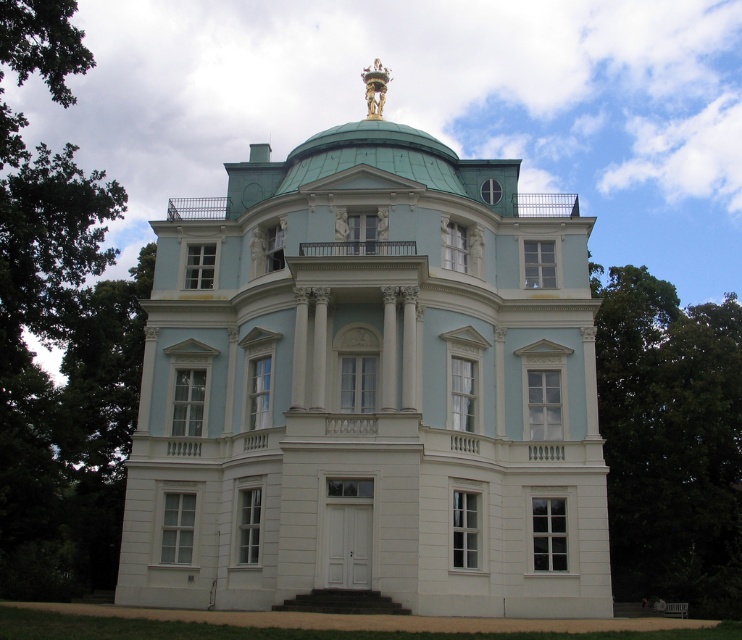
You are an architect planning to add a new sculpture on the roof of the light blue stone mansion at center. The sculpture requires a flat area that is not covered by the green metallic dome at center. Based on the image, is there enough space available on the mansion roof for the sculpture?

The light blue stone mansion at center is positioned under the green metallic dome at center, which means the dome covers part of the mansion roof. Therefore, there might be limited space available for the sculpture on the mansion roof where it is not covered by the dome.

You are standing at the entrance of the light blue stone mansion at center. If you walk straight ahead, will you eventually face the golden statue on the dome? Please explain your reasoning based on the building layout.

Yes, because the golden statue is on the dome at the center of the building, so walking straight from the entrance would lead you towards the center, facing the dome and its statue.